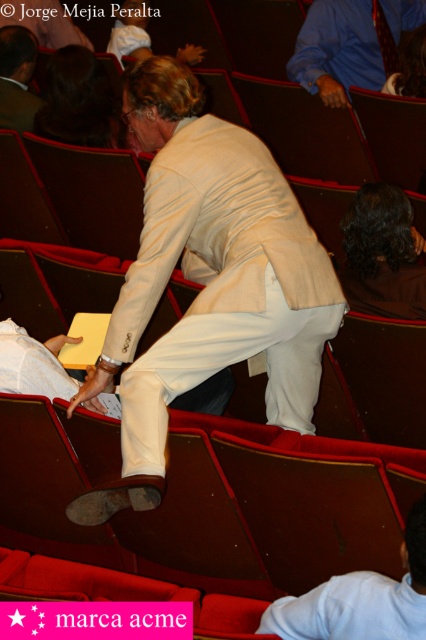
Question: Which point is closer to the camera?

Choices:
 (A) (408, 84)
 (B) (215, 307)
 (C) (5, 93)
 (D) (367, 243)

Answer: (B)

Question: Which point is closer to the camera?

Choices:
 (A) matte black jacket at upper left
 (B) matte white suit at center
 (C) fluffy white cat at upper right

Answer: (B)

Question: Can you confirm if brown fabric hair at center is positioned below dark brown hair at upper left?

Choices:
 (A) yes
 (B) no

Answer: (A)

Question: Can you confirm if dark brown hair at upper left is positioned to the left of fluffy white cat at upper right?

Choices:
 (A) yes
 (B) no

Answer: (A)

Question: Which of these objects is positioned closest to the matte black jacket at upper left?

Choices:
 (A) brown fabric hair at center
 (B) dark brown hair at upper left
 (C) matte white suit at center
 (D) fluffy white cat at upper right

Answer: (B)

Question: Can you confirm if dark brown hair at upper left is thinner than fluffy white cat at upper right?

Choices:
 (A) yes
 (B) no

Answer: (B)